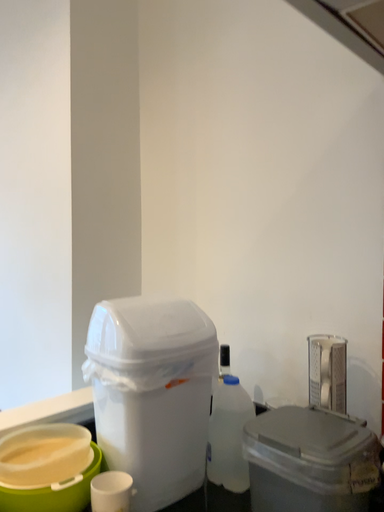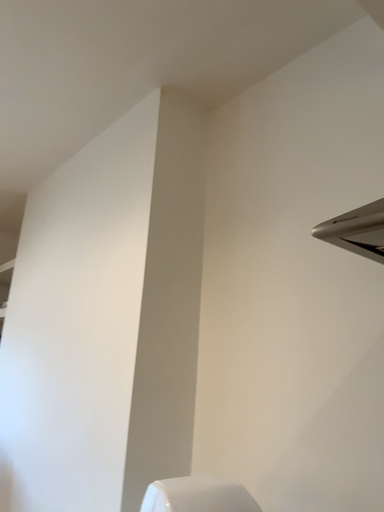
Question: Which way did the camera rotate in the video?

Choices:
 (A) rotated left
 (B) rotated right

Answer: (A)